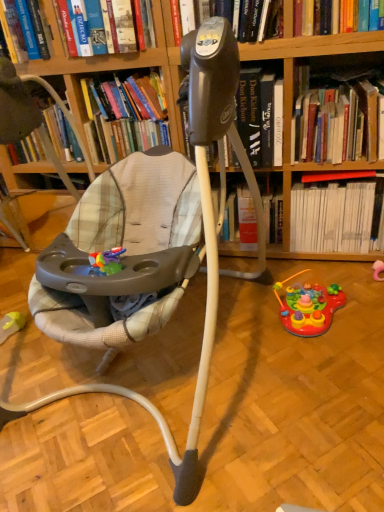
Locate an element on the screen. The width and height of the screenshot is (384, 512). vacant space positioned to the left of pink rubber toy at lower right, positioned as the 3th toy in left-to-right order is located at coordinates (348, 281).